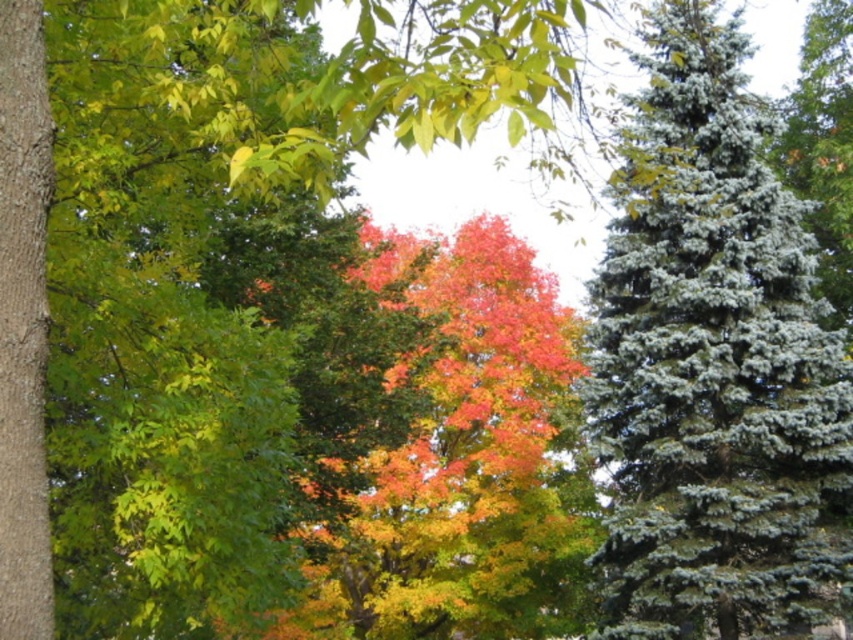
You are an artist trying to capture the autumn scene. You want to paint the vivid orange leaves at center and the smooth brown bark at left. Which object should you focus on first if you want to paint larger details first?

The vivid orange leaves at center has a larger size compared to the smooth brown bark at left, so you should focus on painting the vivid orange leaves at center first to handle the larger details before moving to the smaller ones.